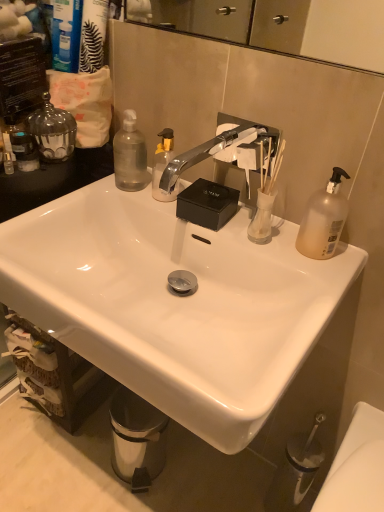
Question: Is transparent plastic bottle at upper left, the 2th bottle in the right-to-left sequence, located within translucent plastic soap dispenser at left, the second toiletry in the right-to-left sequence?

Choices:
 (A) no
 (B) yes

Answer: (A)

Question: From the image's perspective, is translucent plastic soap dispenser at left, the first toiletry when ordered from left to right, above transparent plastic bottle at upper left, the 2th bottle in the right-to-left sequence?

Choices:
 (A) yes
 (B) no

Answer: (B)

Question: Does translucent plastic soap dispenser at left, the second toiletry in the right-to-left sequence, have a larger size compared to transparent plastic bottle at upper left, the 2th bottle in the right-to-left sequence?

Choices:
 (A) yes
 (B) no

Answer: (B)

Question: Can you confirm if translucent plastic soap dispenser at left, the first toiletry when ordered from left to right, is thinner than transparent plastic bottle at upper left, the 2th bottle in the right-to-left sequence?

Choices:
 (A) no
 (B) yes

Answer: (B)

Question: Is translucent plastic soap dispenser at left, the second toiletry in the right-to-left sequence, closer to the viewer compared to transparent plastic bottle at upper left, which is the first bottle from left to right?

Choices:
 (A) yes
 (B) no

Answer: (A)

Question: From a real-world perspective, is chrome metallic faucet at center positioned above or below stainless steel trash can at lower left?

Choices:
 (A) below
 (B) above

Answer: (B)

Question: In terms of height, does chrome metallic faucet at center look taller or shorter compared to stainless steel trash can at lower left?

Choices:
 (A) tall
 (B) short

Answer: (B)

Question: Is chrome metallic faucet at center inside or outside of stainless steel trash can at lower left?

Choices:
 (A) inside
 (B) outside

Answer: (B)

Question: Is point (235, 137) positioned closer to the camera than point (148, 463)?

Choices:
 (A) closer
 (B) farther

Answer: (A)

Question: From a real-world perspective, relative to translucent plastic soap dispenser at left, the second toiletry in the right-to-left sequence, is stainless steel trash can at lower left vertically above or below?

Choices:
 (A) above
 (B) below

Answer: (B)

Question: Considering the positions of stainless steel trash can at lower left and translucent plastic soap dispenser at left, the second toiletry in the right-to-left sequence, in the image, is stainless steel trash can at lower left bigger or smaller than translucent plastic soap dispenser at left, the second toiletry in the right-to-left sequence,?

Choices:
 (A) big
 (B) small

Answer: (A)

Question: Considering their positions, is stainless steel trash can at lower left located in front of or behind translucent plastic soap dispenser at left, the first toiletry when ordered from left to right?

Choices:
 (A) behind
 (B) front

Answer: (A)

Question: Is stainless steel trash can at lower left inside or outside of translucent plastic soap dispenser at left, the first toiletry when ordered from left to right?

Choices:
 (A) inside
 (B) outside

Answer: (B)

Question: From a real-world perspective, relative to stainless steel trash can at lower left, is translucent plastic pump bottle at right, which is counted as the first bottle, starting from the front, vertically above or below?

Choices:
 (A) below
 (B) above

Answer: (B)

Question: Is translucent plastic pump bottle at right, which is the first bottle in right-to-left order, in front of or behind stainless steel trash can at lower left in the image?

Choices:
 (A) front
 (B) behind

Answer: (A)